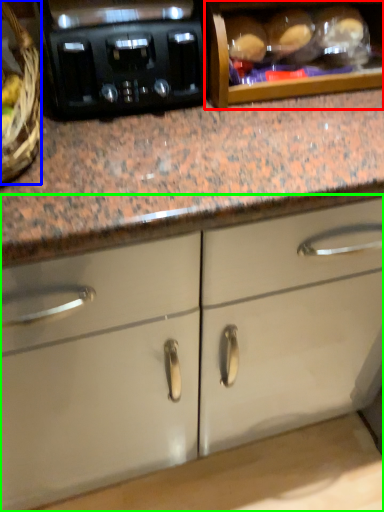
Question: Estimate the real-world distances between objects in this image. Which object is farther from cabinetry (highlighted by a red box), basket (highlighted by a blue box) or cabinetry (highlighted by a green box)?

Choices:
 (A) basket
 (B) cabinetry

Answer: (B)